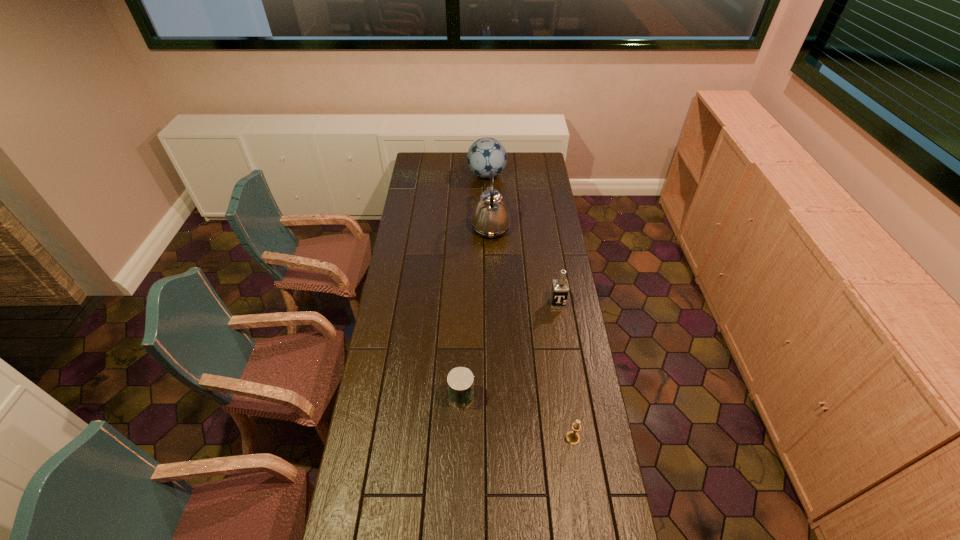
Locate an element on the screen. The height and width of the screenshot is (540, 960). vacant space located on the side with brand of the soccer ball is located at coordinates (459, 175).

Find the location of a particular element. Image resolution: width=960 pixels, height=540 pixels. vacant space located on the side with brand of the soccer ball is located at coordinates (458, 175).

Where is `vacant point located on the side with brand of the soccer ball`? The image size is (960, 540). vacant point located on the side with brand of the soccer ball is located at coordinates (456, 175).

Identify the location of vacant region located 0.080m on the front label of the third farthest object. Image resolution: width=960 pixels, height=540 pixels. (561, 323).

Where is `vacant area located 0.330m on the back of the can`? The height and width of the screenshot is (540, 960). vacant area located 0.330m on the back of the can is located at coordinates (464, 319).

The width and height of the screenshot is (960, 540). I want to click on free spot located 0.230m on the front of the nearest object, so click(x=585, y=518).

The image size is (960, 540). What are the coordinates of `object present at the far edge` in the screenshot? It's located at (485, 154).

Locate an element on the screen. vodka present at the right edge is located at coordinates (560, 287).

The height and width of the screenshot is (540, 960). Identify the location of candle holder that is positioned at the right edge. (572, 437).

The image size is (960, 540). In the image, there is a desktop. What are the coordinates of `vacant area at the left edge` in the screenshot? It's located at (379, 453).